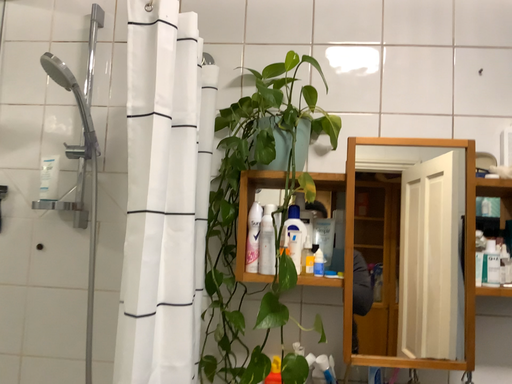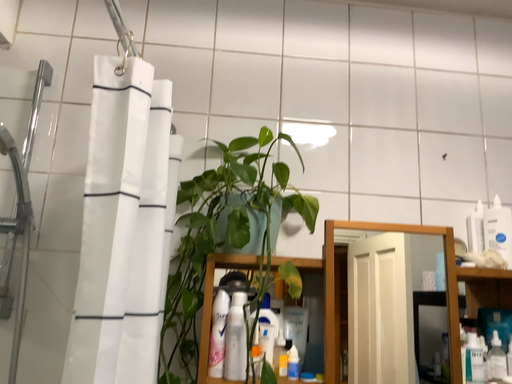
Question: Which way did the camera rotate in the video?

Choices:
 (A) rotated left
 (B) rotated right

Answer: (B)